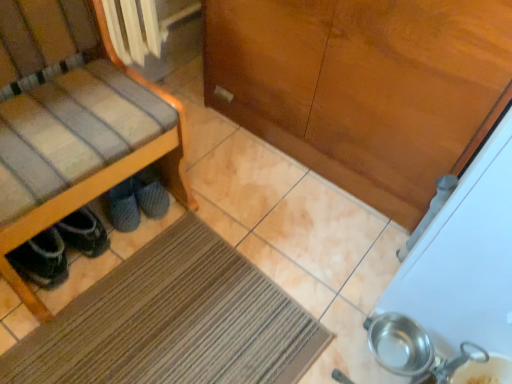
Question: From the image's perspective, would you say wooden chair at left is shown under dark gray suede shoes under chair left, arranged as the first footwear when viewed from the front?

Choices:
 (A) yes
 (B) no

Answer: (B)

Question: Is dark gray suede shoes under chair left, arranged as the first footwear when viewed from the front, inside wooden chair at left?

Choices:
 (A) yes
 (B) no

Answer: (A)

Question: Considering the relative positions of wooden chair at left and dark gray suede shoes under chair left, positioned as the first footwear in left-to-right order, in the image provided, is wooden chair at left to the left of dark gray suede shoes under chair left, positioned as the first footwear in left-to-right order, from the viewer's perspective?

Choices:
 (A) no
 (B) yes

Answer: (A)

Question: From a real-world perspective, is wooden chair at left beneath dark gray suede shoes under chair left, positioned as the first footwear in left-to-right order?

Choices:
 (A) no
 (B) yes

Answer: (A)

Question: Considering the relative sizes of wooden chair at left and dark gray suede shoes under chair left, which ranks as the 2th footwear in right-to-left order, in the image provided, is wooden chair at left thinner than dark gray suede shoes under chair left, which ranks as the 2th footwear in right-to-left order,?

Choices:
 (A) no
 (B) yes

Answer: (A)

Question: Does wooden chair at left come in front of dark gray suede shoes under chair left, acting as the 2th footwear starting from the back?

Choices:
 (A) no
 (B) yes

Answer: (B)

Question: Can you confirm if dark gray suede shoes under chair left, acting as the 2th footwear starting from the back, is thinner than gray fuzzy slippers at lower left, which is the 2th footwear from front to back?

Choices:
 (A) no
 (B) yes

Answer: (B)

Question: From a real-world perspective, is dark gray suede shoes under chair left, which ranks as the 2th footwear in right-to-left order, on gray fuzzy slippers at lower left, which is the 1th footwear in back-to-front order?

Choices:
 (A) no
 (B) yes

Answer: (B)

Question: Is dark gray suede shoes under chair left, positioned as the first footwear in left-to-right order, next to gray fuzzy slippers at lower left, which is the 2th footwear from left to right?

Choices:
 (A) yes
 (B) no

Answer: (B)

Question: Is dark gray suede shoes under chair left, acting as the 2th footwear starting from the back, positioned beyond the bounds of gray fuzzy slippers at lower left, which is counted as the 1th footwear, starting from the right?

Choices:
 (A) no
 (B) yes

Answer: (B)

Question: Is dark gray suede shoes under chair left, arranged as the first footwear when viewed from the front, positioned behind gray fuzzy slippers at lower left, which is the 2th footwear from front to back?

Choices:
 (A) yes
 (B) no

Answer: (B)

Question: Considering the relative sizes of dark gray suede shoes under chair left, which ranks as the 2th footwear in right-to-left order, and gray fuzzy slippers at lower left, which is the 1th footwear in back-to-front order, in the image provided, is dark gray suede shoes under chair left, which ranks as the 2th footwear in right-to-left order, taller than gray fuzzy slippers at lower left, which is the 1th footwear in back-to-front order,?

Choices:
 (A) no
 (B) yes

Answer: (B)

Question: Does wooden chair at left turn towards gray fuzzy slippers at lower left, which is the 2th footwear from front to back?

Choices:
 (A) yes
 (B) no

Answer: (B)